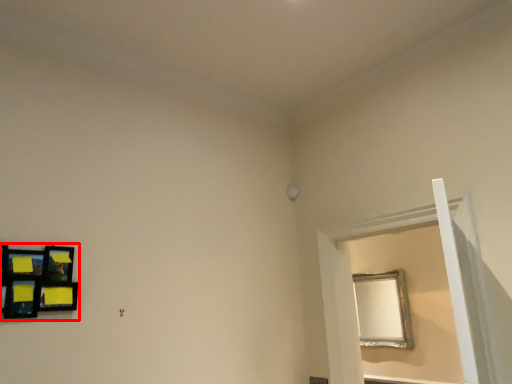
Question: From the image's perspective, where is picture frame (annotated by the red box) located in relation to window frame in the image?

Choices:
 (A) above
 (B) below

Answer: (A)